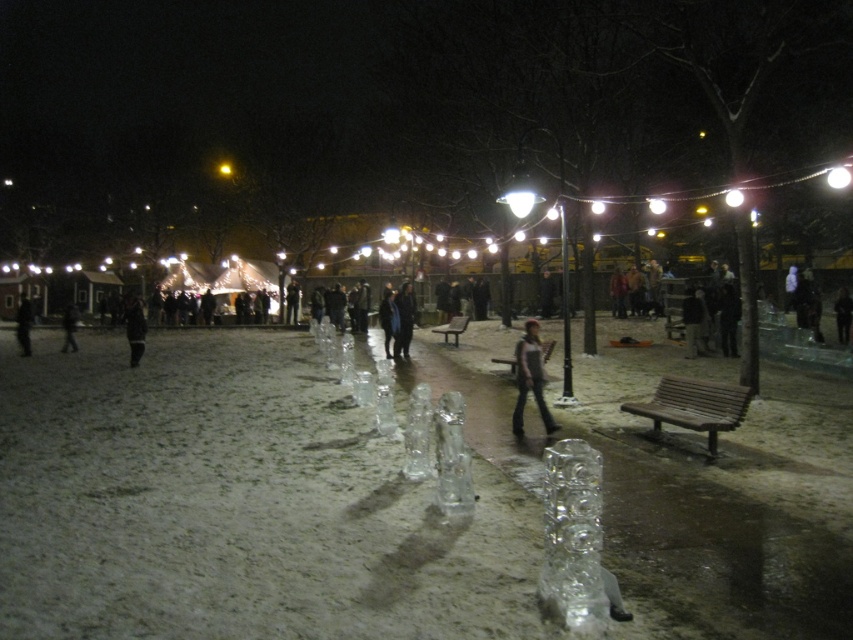
Question: Which point is closer to the camera taking this photo?

Choices:
 (A) (131, 312)
 (B) (537, 342)

Answer: (B)

Question: Among these objects, which one is farthest from the camera?

Choices:
 (A) black matte jacket at center
 (B) dark gray jeans at center

Answer: (A)

Question: Does dark gray jeans at center appear on the right side of black matte jacket at center?

Choices:
 (A) no
 (B) yes

Answer: (B)

Question: Can you confirm if dark gray jeans at center is positioned to the right of black matte jacket at center?

Choices:
 (A) yes
 (B) no

Answer: (A)

Question: Which point is closer to the camera?

Choices:
 (A) (538, 413)
 (B) (143, 332)

Answer: (A)

Question: Does dark gray jeans at center have a larger size compared to black matte jacket at center?

Choices:
 (A) no
 (B) yes

Answer: (A)